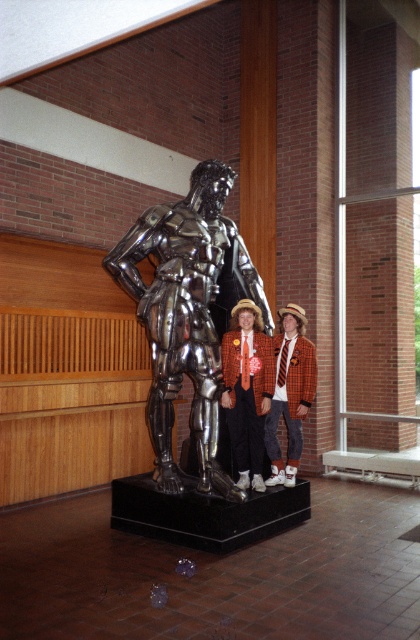
Question: Does shiny metallic statue at center appear on the right side of orange wool blazer at center?

Choices:
 (A) yes
 (B) no

Answer: (B)

Question: Among these points, which one is farthest from the camera?

Choices:
 (A) (172, 308)
 (B) (231, 385)

Answer: (B)

Question: Which is nearer to the orange wool blazer at center?

Choices:
 (A) red plaid blazer at center
 (B) shiny metallic statue at center

Answer: (A)

Question: Considering the real-world distances, which object is closest to the shiny metallic statue at center?

Choices:
 (A) orange wool blazer at center
 (B) red plaid blazer at center

Answer: (B)

Question: Is shiny metallic statue at center positioned at the back of red plaid blazer at center?

Choices:
 (A) no
 (B) yes

Answer: (A)

Question: Does red plaid blazer at center appear on the left side of orange wool blazer at center?

Choices:
 (A) no
 (B) yes

Answer: (B)